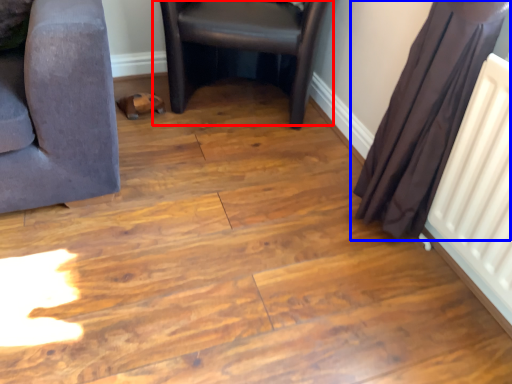
Question: Which object is further to the camera taking this photo, chair (highlighted by a red box) or curtain (highlighted by a blue box)?

Choices:
 (A) chair
 (B) curtain

Answer: (A)